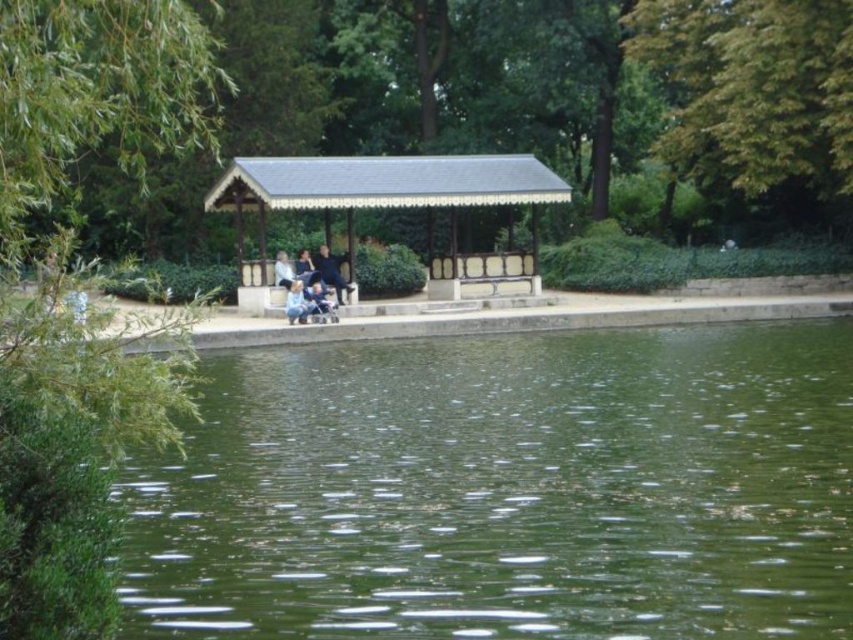
Question: Is wooden gazebo at center behind light blue denim jacket at center?

Choices:
 (A) no
 (B) yes

Answer: (A)

Question: Which object is positioned closest to the blue denim jeans at center?

Choices:
 (A) green leafy tree at center
 (B) dark blue jeans at center

Answer: (B)

Question: From the image, what is the correct spatial relationship of green leafy tree at upper left in relation to dark blue fabric jacket at center?

Choices:
 (A) left
 (B) right

Answer: (A)

Question: Can you confirm if green leafy tree at center is bigger than wooden gazebo at center?

Choices:
 (A) no
 (B) yes

Answer: (B)

Question: Which point is farther to the camera?

Choices:
 (A) light blue denim jeans at center
 (B) dark blue fabric jacket at center

Answer: (B)

Question: Considering the real-world distances, which object is farthest from the wooden gazebo at center?

Choices:
 (A) green leafy tree at upper left
 (B) light blue denim jacket at center
 (C) green leafy tree at center
 (D) dark blue jeans at center

Answer: (A)